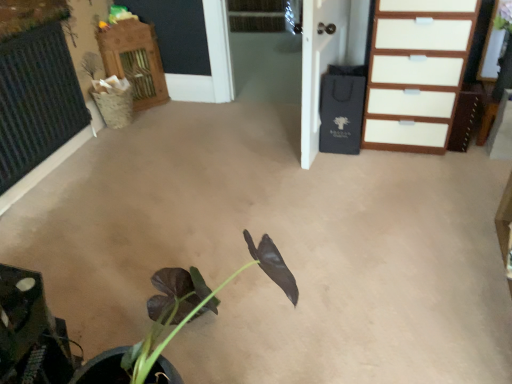
Question: Can you confirm if black paper bag at upper right is thinner than white glossy chest of drawers at upper right?

Choices:
 (A) no
 (B) yes

Answer: (B)

Question: Considering the relative sizes of black paper bag at upper right and white glossy chest of drawers at upper right in the image provided, is black paper bag at upper right shorter than white glossy chest of drawers at upper right?

Choices:
 (A) no
 (B) yes

Answer: (A)

Question: Considering the relative sizes of black paper bag at upper right and white glossy chest of drawers at upper right in the image provided, is black paper bag at upper right taller than white glossy chest of drawers at upper right?

Choices:
 (A) yes
 (B) no

Answer: (A)

Question: Considering the relative sizes of black paper bag at upper right and white glossy chest of drawers at upper right in the image provided, is black paper bag at upper right smaller than white glossy chest of drawers at upper right?

Choices:
 (A) no
 (B) yes

Answer: (B)

Question: From a real-world perspective, is black paper bag at upper right over white glossy chest of drawers at upper right?

Choices:
 (A) no
 (B) yes

Answer: (B)

Question: Is black paper bag at upper right turned away from white glossy chest of drawers at upper right?

Choices:
 (A) yes
 (B) no

Answer: (A)

Question: From a real-world perspective, is black paper bag at upper right on wooden cabinet at upper left?

Choices:
 (A) yes
 (B) no

Answer: (A)

Question: Can you confirm if black paper bag at upper right is wider than wooden cabinet at upper left?

Choices:
 (A) yes
 (B) no

Answer: (B)

Question: Is the depth of black paper bag at upper right greater than that of wooden cabinet at upper left?

Choices:
 (A) no
 (B) yes

Answer: (A)

Question: Is black paper bag at upper right placed right next to wooden cabinet at upper left?

Choices:
 (A) yes
 (B) no

Answer: (B)

Question: Could you tell me if black paper bag at upper right is turned towards wooden cabinet at upper left?

Choices:
 (A) no
 (B) yes

Answer: (A)

Question: Considering the relative sizes of black paper bag at upper right and wooden cabinet at upper left in the image provided, is black paper bag at upper right smaller than wooden cabinet at upper left?

Choices:
 (A) yes
 (B) no

Answer: (B)

Question: Is wooden cabinet at upper left at the right side of white glossy chest of drawers at upper right?

Choices:
 (A) yes
 (B) no

Answer: (B)